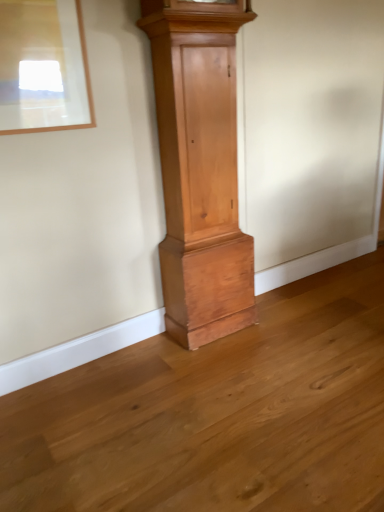
Question: Considering the positions of natural wood grandfather clock at center and matte wooden picture frame at upper left in the image, is natural wood grandfather clock at center bigger or smaller than matte wooden picture frame at upper left?

Choices:
 (A) big
 (B) small

Answer: (A)

Question: Which is correct: natural wood grandfather clock at center is inside matte wooden picture frame at upper left, or outside of it?

Choices:
 (A) outside
 (B) inside

Answer: (A)

Question: Considering the relative positions of natural wood grandfather clock at center and matte wooden picture frame at upper left in the image provided, is natural wood grandfather clock at center to the left or to the right of matte wooden picture frame at upper left?

Choices:
 (A) left
 (B) right

Answer: (B)

Question: From their relative heights in the image, would you say matte wooden picture frame at upper left is taller or shorter than natural wood grandfather clock at center?

Choices:
 (A) tall
 (B) short

Answer: (B)

Question: Looking at the image, does matte wooden picture frame at upper left seem bigger or smaller compared to natural wood grandfather clock at center?

Choices:
 (A) big
 (B) small

Answer: (B)

Question: Is matte wooden picture frame at upper left wider or thinner than natural wood grandfather clock at center?

Choices:
 (A) wide
 (B) thin

Answer: (B)

Question: Considering their positions, is matte wooden picture frame at upper left located in front of or behind natural wood grandfather clock at center?

Choices:
 (A) behind
 (B) front

Answer: (B)